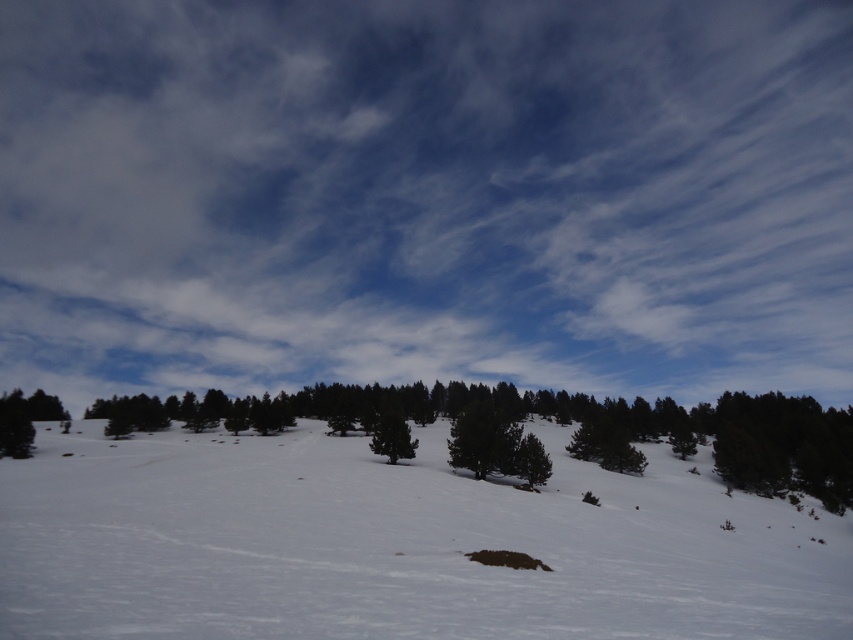
What are the coordinates of the white fluffy cloud at upper center in the winter landscape image?

The white fluffy cloud at upper center is located at coordinates point [426,195].

You are standing at the edge of the snow and want to walk to the dense cluster of evergreen trees in the midground. According to the coordinates provided, is the white powdery snow at center directly in your path?

The white powdery snow at center is located at point (395, 544), so yes, it is directly in your path as you walk towards the dense cluster of evergreen trees in the midground.